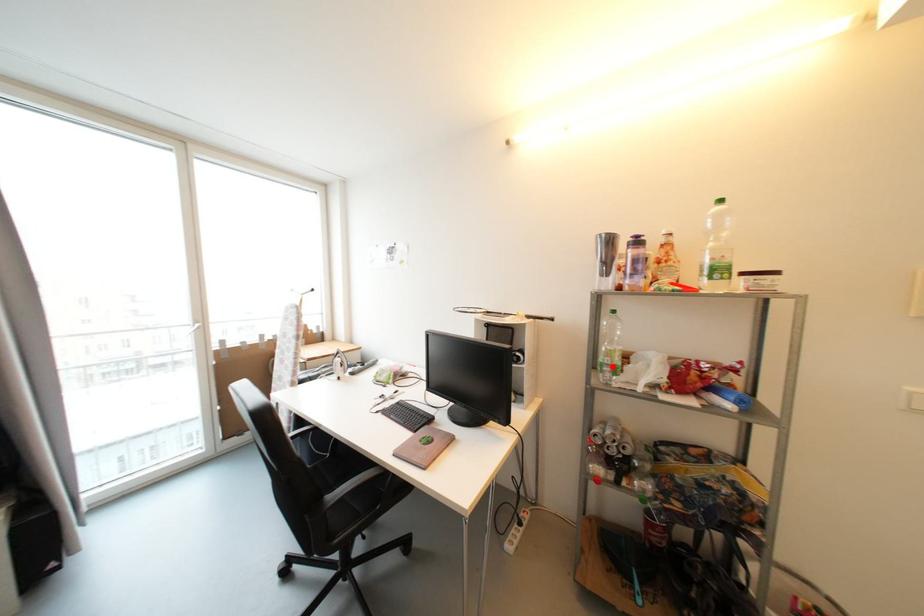
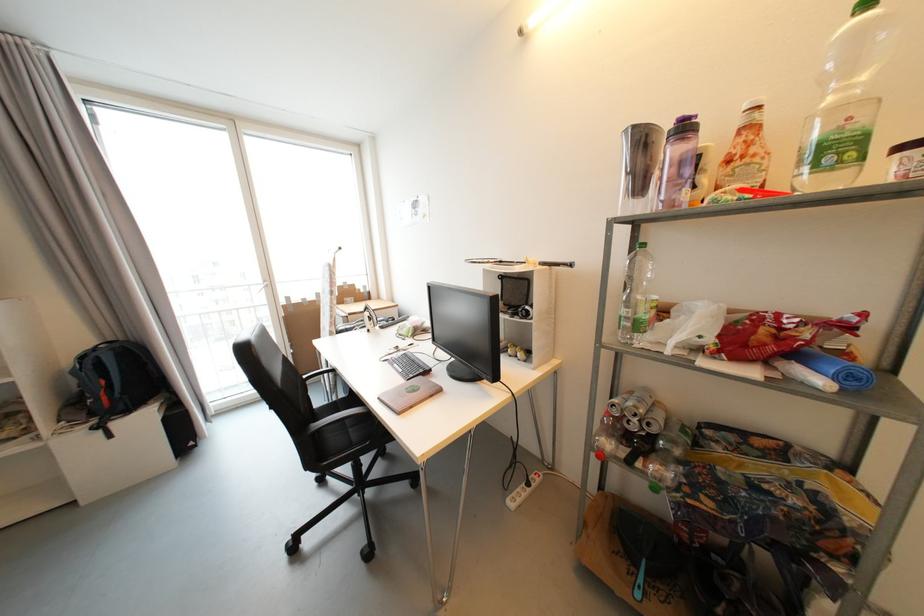
In the second image, find the point that corresponds to the highlighted location in the first image.

(631, 320)